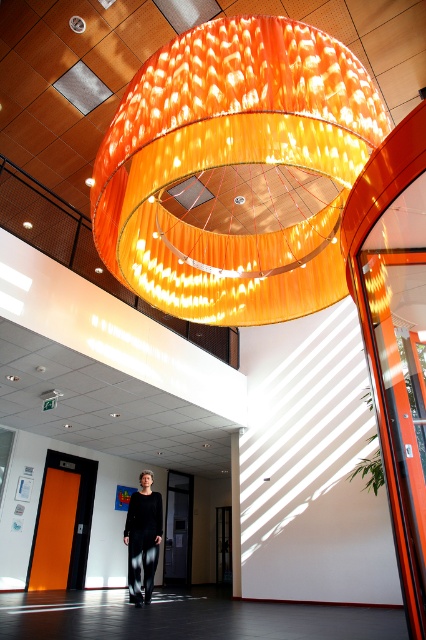
You are a photographer setting up a shoot in this room. You need to position a light sensor to measure the brightness under the orange glossy chandelier at center and near the black textured pants at center. Which location will have higher brightness?

The location under the orange glossy chandelier at center will have higher brightness because the chandelier is above the black textured pants at center, casting direct light downward.

You are a painter who wants to paint the orange glossy chandelier at center and the black textured pants at center. Which object is shorter?

The orange glossy chandelier at center is shorter than the black textured pants at center.

You are planning to install a new light fixture in your living room and want to ensure it will fit. The current space allocated for the light fixture is the size of the black textured pants at center. Can the orange glossy chandelier at center be installed there?

The orange glossy chandelier at center is bigger than the black textured pants at center, so it cannot be installed in the space allocated for the light fixture.